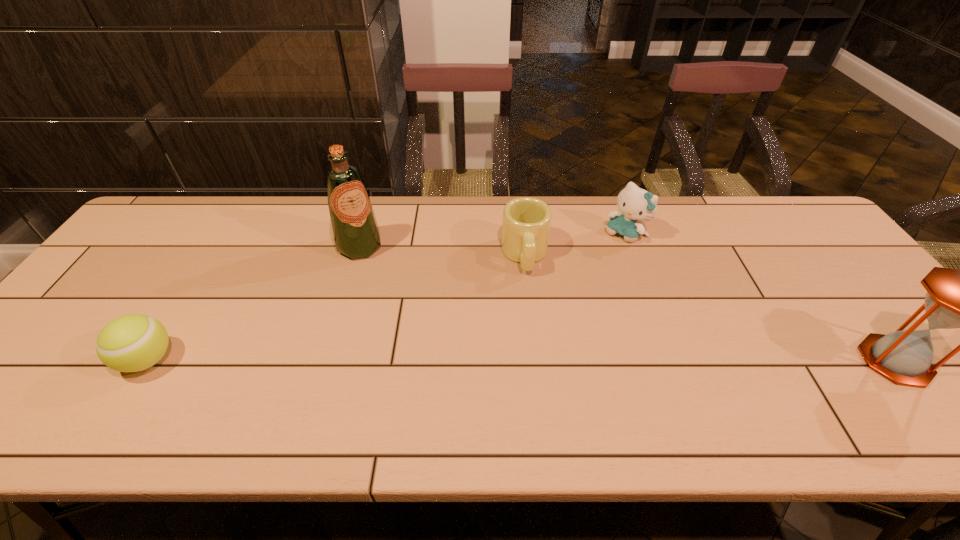
The image size is (960, 540). Find the location of `vacant space situated 0.170m on the front-facing side of the second object from left to right`. vacant space situated 0.170m on the front-facing side of the second object from left to right is located at coordinates (396, 295).

Where is `blank space located 0.360m on the front-facing side of the second object from left to right`? blank space located 0.360m on the front-facing side of the second object from left to right is located at coordinates (432, 344).

Where is `vacant space situated on the front-facing side of the second object from left to right`? vacant space situated on the front-facing side of the second object from left to right is located at coordinates (389, 286).

Where is `vacant position located on the face of the kitten`? The height and width of the screenshot is (540, 960). vacant position located on the face of the kitten is located at coordinates (567, 288).

This screenshot has width=960, height=540. Find the location of `vacant space positioned 0.090m on the face of the kitten`. vacant space positioned 0.090m on the face of the kitten is located at coordinates (599, 258).

In order to click on free space located on the face of the kitten in this screenshot , I will do `click(586, 271)`.

Where is `free location located with the handle on the side of the mug`? The width and height of the screenshot is (960, 540). free location located with the handle on the side of the mug is located at coordinates (537, 381).

Find the location of a particular element. This screenshot has height=540, width=960. blank area located with the handle on the side of the mug is located at coordinates (531, 318).

The height and width of the screenshot is (540, 960). What are the coordinates of `free space located with the handle on the side of the mug` in the screenshot? It's located at (533, 334).

Locate an element on the screen. This screenshot has height=540, width=960. olive oil situated at the far edge is located at coordinates (356, 233).